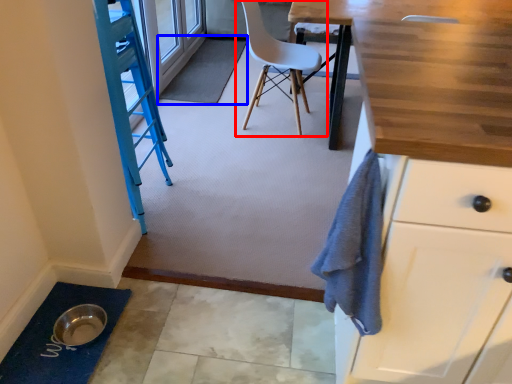
Question: Which object is further to the camera taking this photo, chair (highlighted by a red box) or bath mat (highlighted by a blue box)?

Choices:
 (A) chair
 (B) bath mat

Answer: (B)